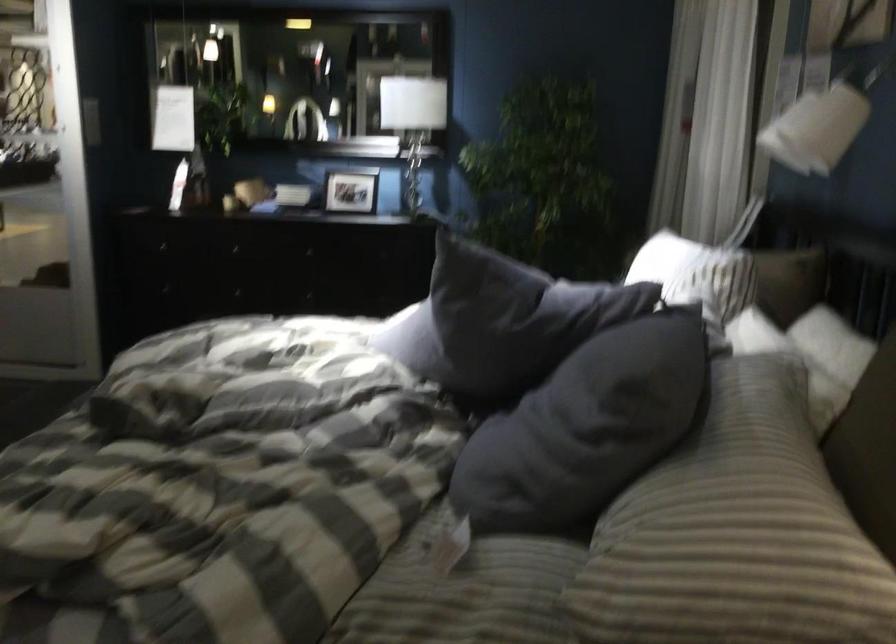
The image size is (896, 644). What are the coordinates of `small picture frame` in the screenshot? It's located at (350, 190).